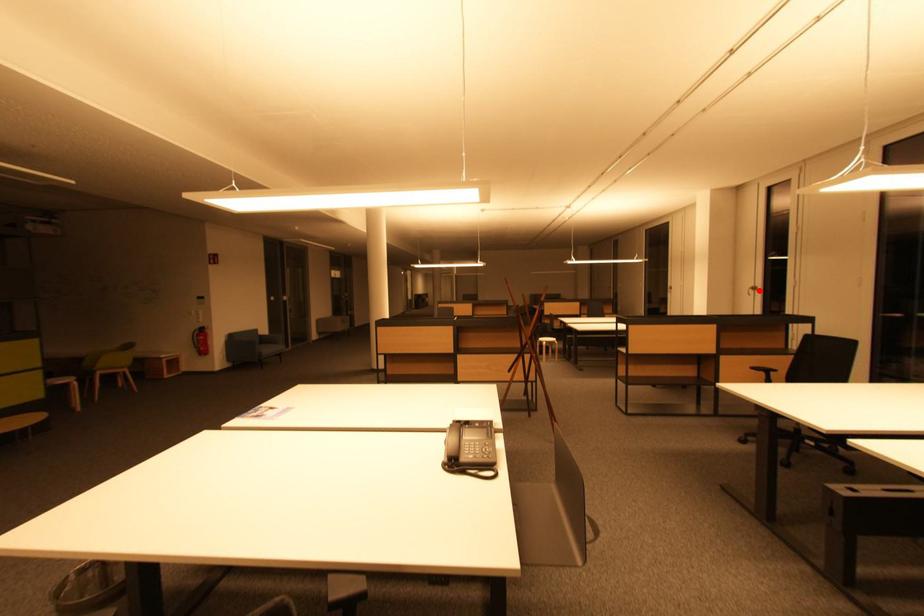
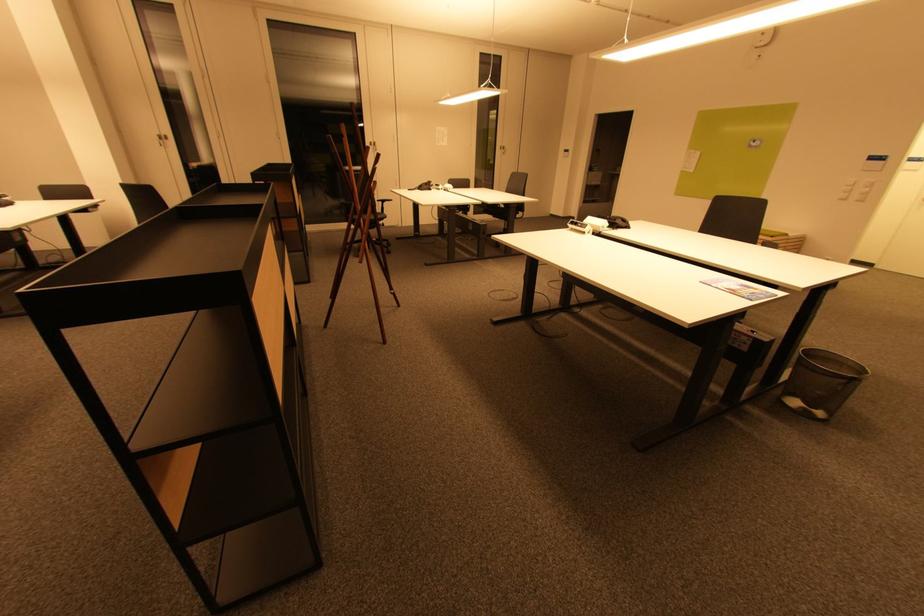
The point at the highlighted location is marked in the first image. Where is the corresponding point in the second image?

(166, 140)